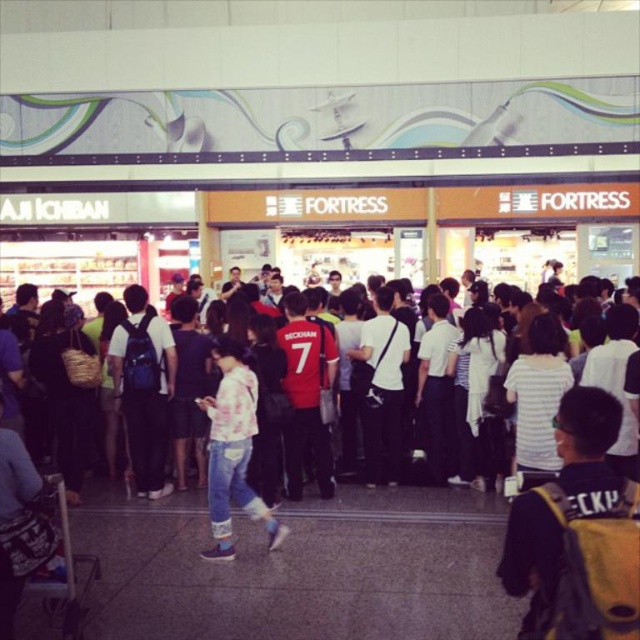
Is point (595, 544) farther from camera compared to point (132, 316)?

No.

Is yellow backpack at center to the right of matte blue backpack at center from the viewer's perspective?

Yes, yellow backpack at center is to the right of matte blue backpack at center.

Between point (536, 508) and point (148, 480), which one is positioned in front?

Point (536, 508) is in front.

Locate an element on the screen. yellow backpack at center is located at coordinates (563, 502).

Is matte blue backpack at center above light pink cotton shirt at center?

Yes.

Who is positioned more to the left, matte blue backpack at center or light pink cotton shirt at center?

matte blue backpack at center

Where is `matte blue backpack at center`? matte blue backpack at center is located at coordinates (144, 387).

Which is more to the right, yellow backpack at center or white cotton shirt at center?

yellow backpack at center is more to the right.

Can you confirm if yellow backpack at center is thinner than white cotton shirt at center?

Indeed, yellow backpack at center has a lesser width compared to white cotton shirt at center.

You are a GUI agent. You are given a task and a screenshot of the screen. Output one action in this format:
    pyautogui.click(x=<x>, y=<y>)
    Task: Click on the yellow backpack at center
    Image resolution: width=640 pixels, height=640 pixels.
    Given the screenshot: What is the action you would take?
    pyautogui.click(x=563, y=502)